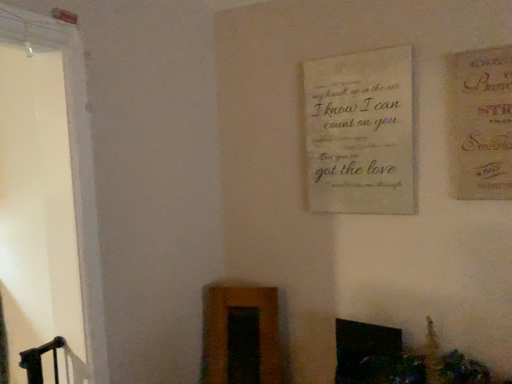
Question: From a real-world perspective, is black glossy fireplace at lower center above or below matte beige postcard at upper right?

Choices:
 (A) above
 (B) below

Answer: (B)

Question: Is black glossy fireplace at lower center inside the boundaries of matte beige postcard at upper right, or outside?

Choices:
 (A) outside
 (B) inside

Answer: (A)

Question: Estimate the real-world distances between objects in this image. Which object is farther from the off-white fabric plaque at center?

Choices:
 (A) black glossy fireplace at lower center
 (B) matte beige postcard at upper right

Answer: (A)

Question: Which object is positioned farthest from the off-white fabric plaque at center?

Choices:
 (A) black glossy fireplace at lower center
 (B) matte beige postcard at upper right

Answer: (A)